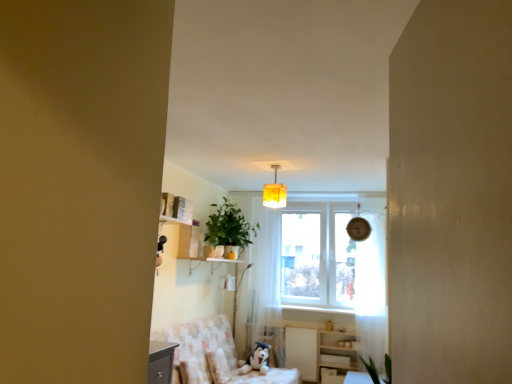
Question: From the image's perspective, is white sheer curtain at center, positioned as the first curtain in back-to-front order, on top of fluffy white pillow at lower center?

Choices:
 (A) yes
 (B) no

Answer: (A)

Question: Is white sheer curtain at center, which is the 2th curtain in front-to-back order, at the left side of fluffy white pillow at lower center?

Choices:
 (A) no
 (B) yes

Answer: (A)

Question: Can you confirm if white sheer curtain at center, the 2th curtain when ordered from right to left, is smaller than fluffy white pillow at lower center?

Choices:
 (A) no
 (B) yes

Answer: (A)

Question: Is white sheer curtain at center, the 2th curtain when ordered from right to left, positioned behind fluffy white pillow at lower center?

Choices:
 (A) no
 (B) yes

Answer: (B)

Question: From a real-world perspective, is white sheer curtain at center, which is the 2th curtain in front-to-back order, over fluffy white pillow at lower center?

Choices:
 (A) yes
 (B) no

Answer: (A)

Question: Is white sheer curtain at center, which is the 2th curtain in front-to-back order, to the right of fluffy white pillow at lower center from the viewer's perspective?

Choices:
 (A) yes
 (B) no

Answer: (A)

Question: Is white glossy dresser at lower right at the back of yellow fabric lampshade at center?

Choices:
 (A) no
 (B) yes

Answer: (A)

Question: Is yellow fabric lampshade at center outside white glossy dresser at lower right?

Choices:
 (A) no
 (B) yes

Answer: (B)

Question: Is yellow fabric lampshade at center positioned far away from white glossy dresser at lower right?

Choices:
 (A) yes
 (B) no

Answer: (A)

Question: From the image's perspective, is yellow fabric lampshade at center beneath white glossy dresser at lower right?

Choices:
 (A) yes
 (B) no

Answer: (B)

Question: Is yellow fabric lampshade at center thinner than white glossy dresser at lower right?

Choices:
 (A) yes
 (B) no

Answer: (B)

Question: Can you confirm if yellow fabric lampshade at center is bigger than white glossy dresser at lower right?

Choices:
 (A) no
 (B) yes

Answer: (A)

Question: Is wooden table at lower right smaller than yellow fabric lampshade at center?

Choices:
 (A) no
 (B) yes

Answer: (A)